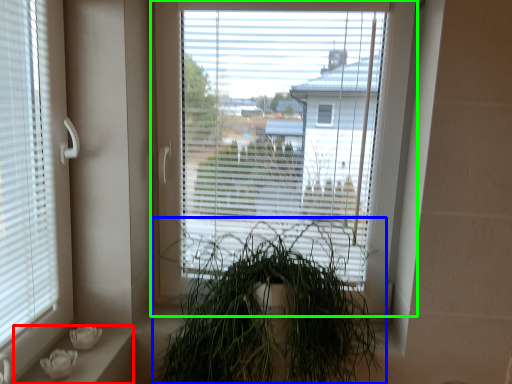
Question: Estimate the real-world distances between objects in this image. Which object is closer to window sill (highlighted by a red box), houseplant (highlighted by a blue box) or window (highlighted by a green box)?

Choices:
 (A) houseplant
 (B) window

Answer: (A)